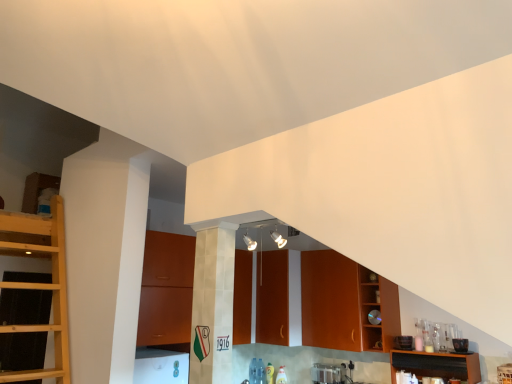
Question: Visually, is matte wood cabinetry at center, which ranks as the fourth cabinetry in right-to-left order, positioned to the left or to the right of wooden cabinet at right, acting as the 1th cabinetry starting from the right?

Choices:
 (A) left
 (B) right

Answer: (A)

Question: Does point (269, 256) appear closer or farther from the camera than point (372, 344)?

Choices:
 (A) closer
 (B) farther

Answer: (B)

Question: Which object is the closest to the brown wooden shelf at lower right?

Choices:
 (A) brown wood cabinet at center, marked as the 3th cabinetry in a left-to-right arrangement
 (B) matte wood cabinet at center, the 2th cabinetry positioned from the left
 (C) matte wood cabinetry at center, positioned as the first cabinetry in left-to-right order
 (D) satin silver toaster at lower center
 (E) wooden cabinet at right, acting as the 1th cabinetry starting from the right

Answer: (E)

Question: Considering the real-world distances, which object is closest to the wooden cabinet at right, the 4th cabinetry positioned from the left?

Choices:
 (A) brown wood cabinet at center, which is counted as the second cabinetry, starting from the right
 (B) satin silver toaster at lower center
 (C) matte wood cabinet at center, the 2th cabinetry positioned from the left
 (D) brown wooden shelf at lower right
 (E) matte wood cabinetry at center, which ranks as the fourth cabinetry in right-to-left order

Answer: (A)